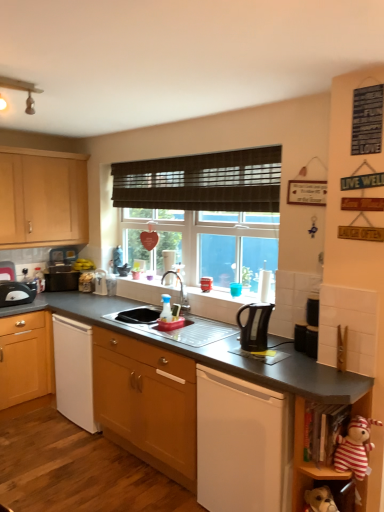
Find the location of `vacant area on top of black plastic toaster at left, acting as the 2th appliance starting from the bottom (from a real-world perspective)`. vacant area on top of black plastic toaster at left, acting as the 2th appliance starting from the bottom (from a real-world perspective) is located at coordinates (71, 267).